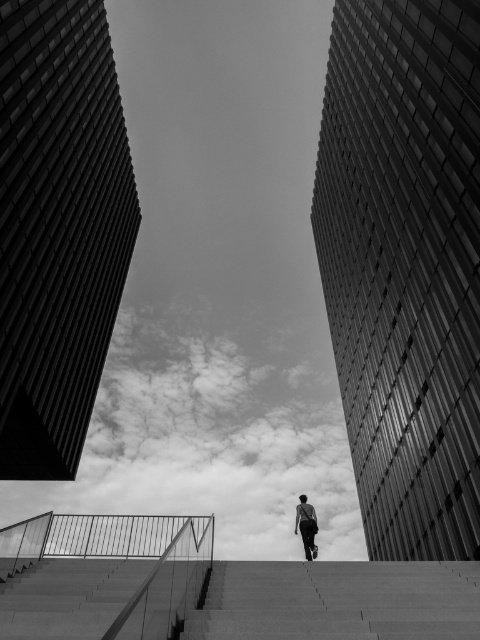
Question: Is smooth concrete stairs at center positioned behind dark gray fabric man at center?

Choices:
 (A) yes
 (B) no

Answer: (B)

Question: Which point is farther to the camera?

Choices:
 (A) dark gray fabric man at center
 (B) smooth concrete stairs at center

Answer: (A)

Question: Is smooth concrete stairs at center positioned before dark gray fabric man at center?

Choices:
 (A) no
 (B) yes

Answer: (B)

Question: Which of the following is the farthest from the observer?

Choices:
 (A) dark gray fabric man at center
 (B) smooth concrete stairs at center

Answer: (A)

Question: Does smooth concrete stairs at center lie in front of dark gray fabric man at center?

Choices:
 (A) yes
 (B) no

Answer: (A)